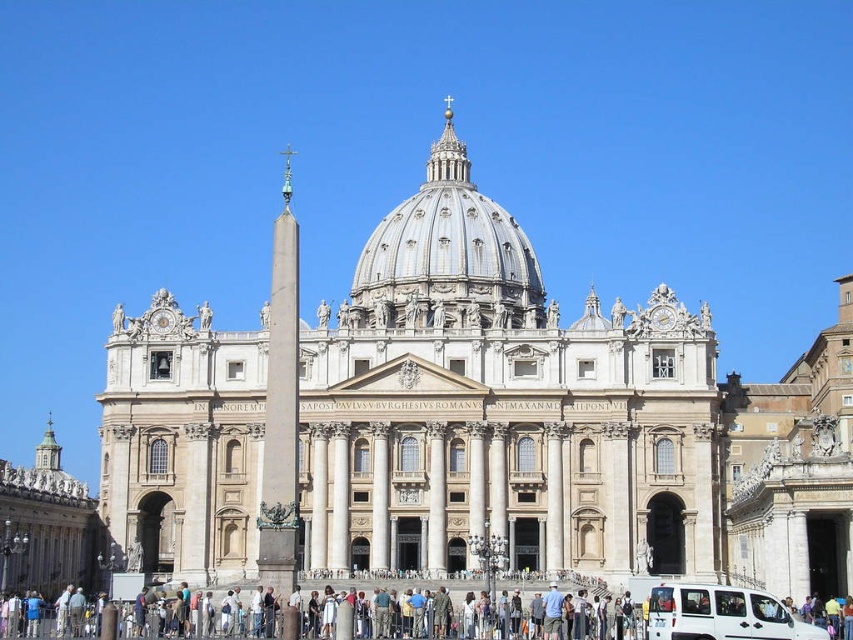
Question: Is white marble church at center smaller than light brown wooden bench at lower center?

Choices:
 (A) yes
 (B) no

Answer: (B)

Question: Can you confirm if beige stone church at right is positioned below white matte van at lower center?

Choices:
 (A) no
 (B) yes

Answer: (A)

Question: Which object appears closest to the camera in this image?

Choices:
 (A) silver metallic dome at center
 (B) white marble church at center
 (C) white matte van at lower center

Answer: (C)

Question: Based on their relative distances, which object is nearer to the silver metallic dome at center?

Choices:
 (A) light brown wooden bench at lower center
 (B) beige stone church at right

Answer: (B)

Question: Which point appears farthest from the camera in this image?

Choices:
 (A) (543, 612)
 (B) (410, 244)

Answer: (B)

Question: Does silver metallic dome at center have a larger size compared to white matte van at lower center?

Choices:
 (A) no
 (B) yes

Answer: (B)